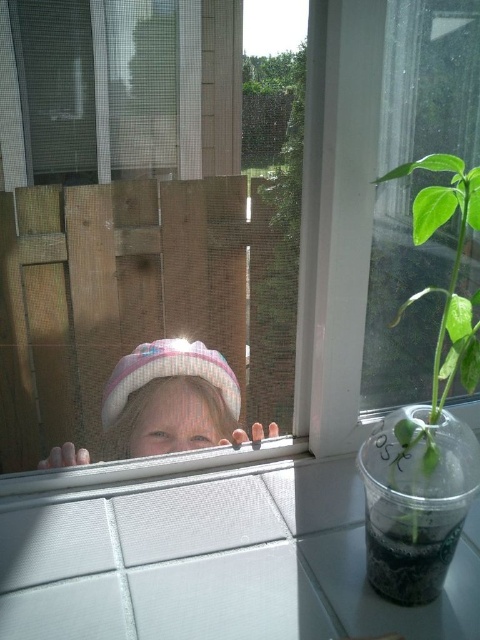
Is pink woolen hat at center taller than green leafy plant at right?

No, pink woolen hat at center is not taller than green leafy plant at right.

Can you confirm if pink woolen hat at center is positioned to the right of green leafy plant at right?

No, pink woolen hat at center is not to the right of green leafy plant at right.

The height and width of the screenshot is (640, 480). In order to click on pink woolen hat at center in this screenshot , I will do `click(171, 400)`.